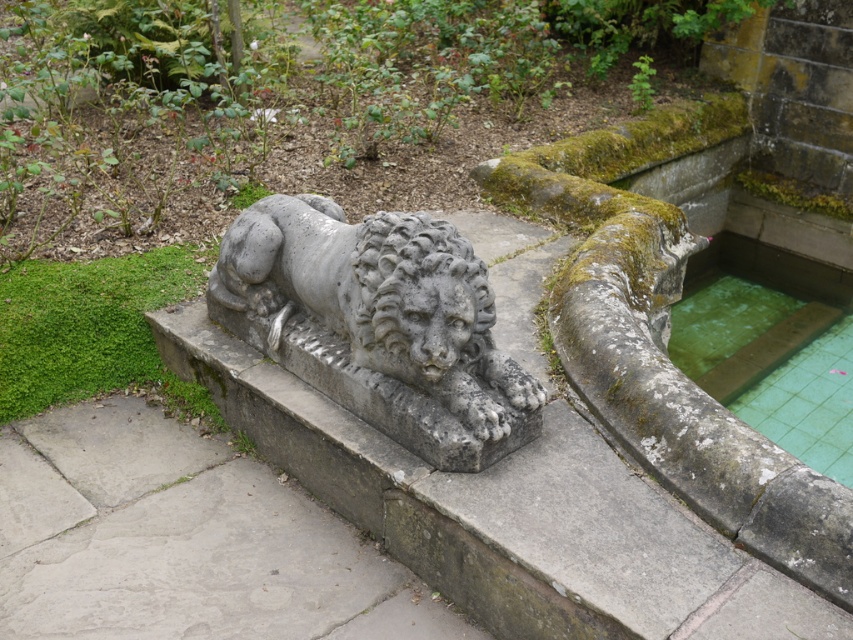
Question: Among these points, which one is nearest to the camera?

Choices:
 (A) (334, 317)
 (B) (834, 380)

Answer: (A)

Question: Which of the following is the closest to the observer?

Choices:
 (A) green tiled water at right
 (B) gray stone lion at center

Answer: (B)

Question: Which object appears closest to the camera in this image?

Choices:
 (A) green tiled water at right
 (B) gray stone lion at center

Answer: (B)

Question: Does gray stone lion at center have a lesser width compared to green tiled water at right?

Choices:
 (A) no
 (B) yes

Answer: (B)

Question: Can you confirm if gray stone lion at center is wider than green tiled water at right?

Choices:
 (A) no
 (B) yes

Answer: (A)

Question: Is gray stone lion at center smaller than green tiled water at right?

Choices:
 (A) yes
 (B) no

Answer: (A)